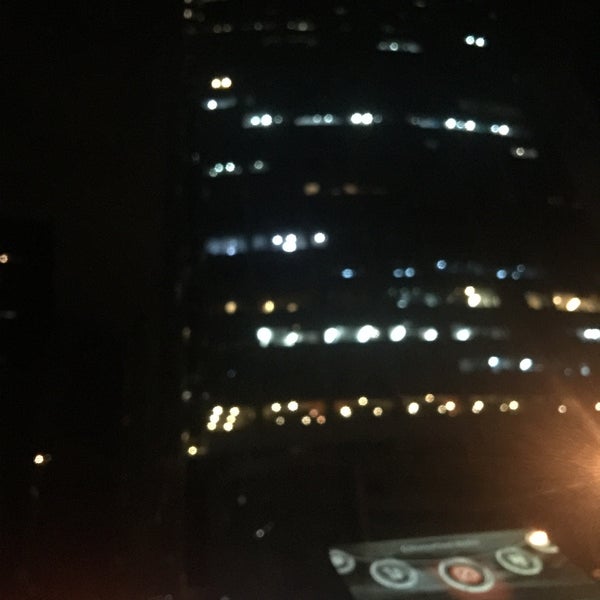
The image size is (600, 600). What are the coordinates of `light brown light` in the screenshot? It's located at (566, 460).